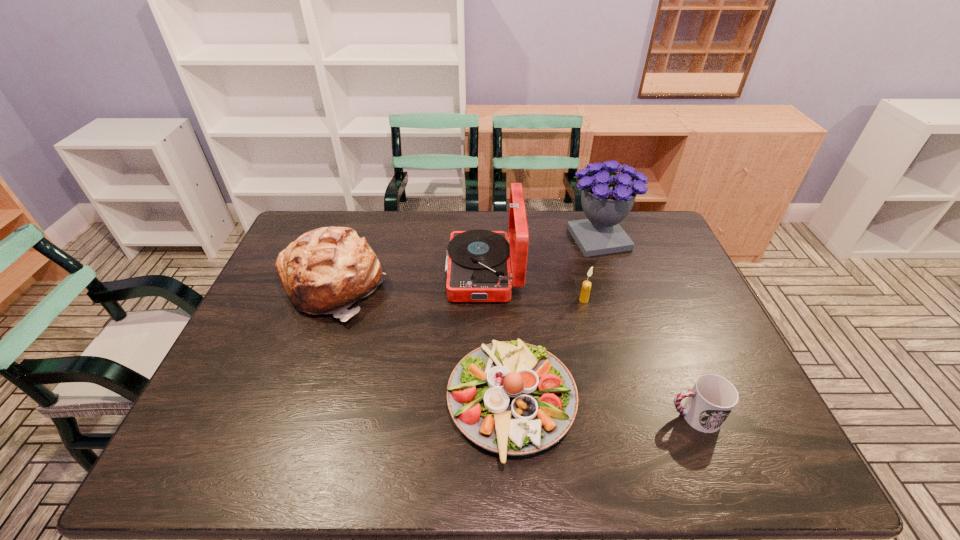
At what (x,y) coordinates should I click in order to perform the action: click on free region that satisfies the following two spatial constraints: 1. on the back side of the salad plate; 2. on the right side of the bouquet. Please return your answer as a coordinate pair (x, y). The image size is (960, 540). Looking at the image, I should click on (502, 239).

The image size is (960, 540). What are the coordinates of `vacant space that satisfies the following two spatial constraints: 1. on the front-facing side of the salad plate; 2. on the right side of the phonograph_record` in the screenshot? It's located at (484, 403).

This screenshot has width=960, height=540. I want to click on vacant area that satisfies the following two spatial constraints: 1. on the back side of the bread; 2. on the right side of the bouquet, so click(x=349, y=239).